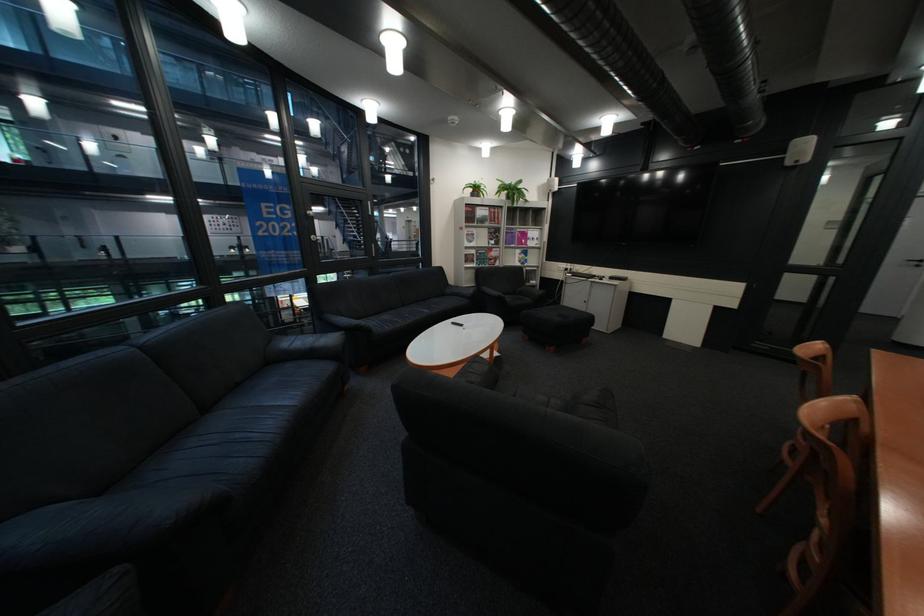
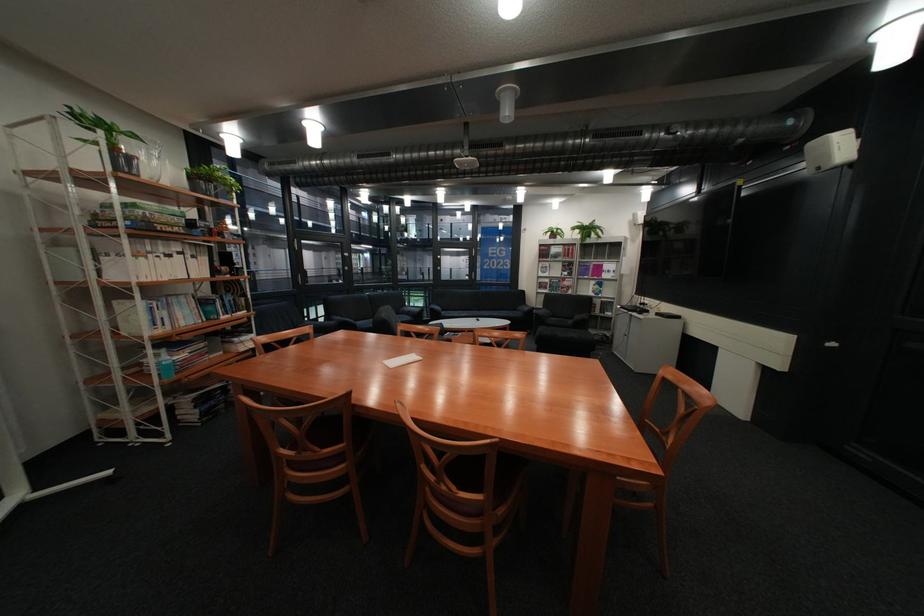
Locate, in the second image, the point that corresponds to point 480,188 in the first image.

(562, 233)